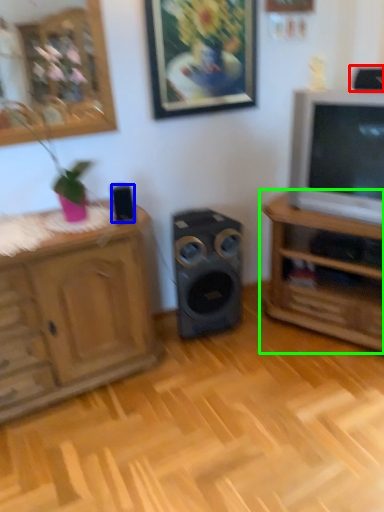
Question: Which is nearer to the speaker (highlighted by a red box)? speaker (highlighted by a blue box) or shelf (highlighted by a green box).

Choices:
 (A) speaker
 (B) shelf

Answer: (B)